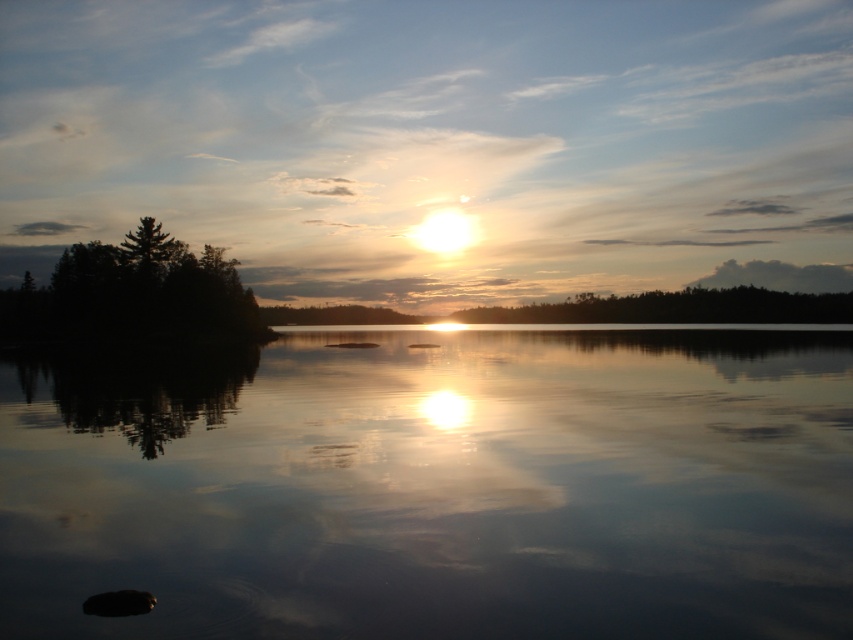
Question: Which object appears farthest from the camera in this image?

Choices:
 (A) dark green textured tree at left
 (B) transparent water at center

Answer: (A)

Question: Does transparent water at center have a larger size compared to dark green textured tree at left?

Choices:
 (A) yes
 (B) no

Answer: (B)

Question: Does transparent water at center have a greater width compared to dark green textured tree at left?

Choices:
 (A) yes
 (B) no

Answer: (A)

Question: Which point appears farthest from the camera in this image?

Choices:
 (A) (335, 620)
 (B) (113, 273)

Answer: (B)

Question: Is transparent water at center to the right of dark green textured tree at left from the viewer's perspective?

Choices:
 (A) no
 (B) yes

Answer: (B)